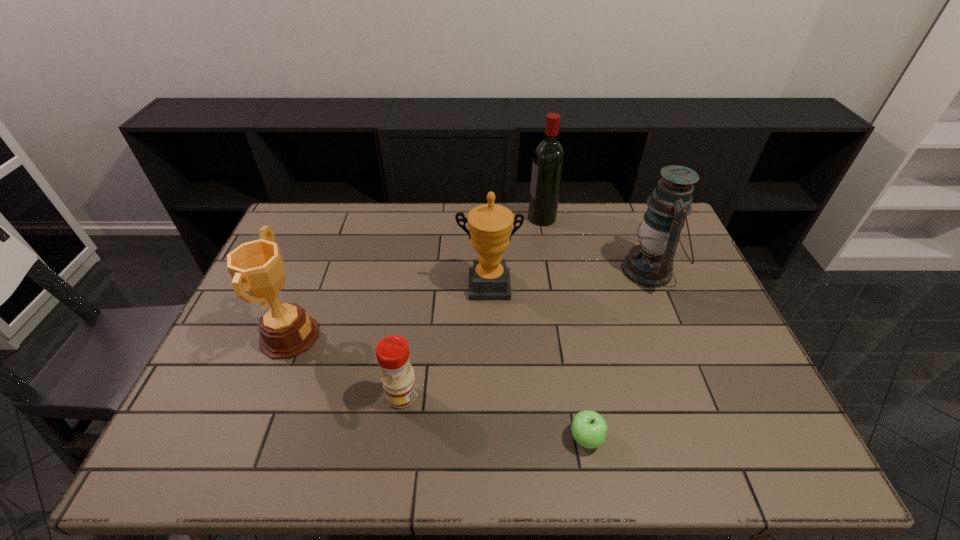
The image size is (960, 540). Identify the location of wine bottle. (548, 161).

This screenshot has height=540, width=960. What are the coordinates of `oil lamp` in the screenshot? It's located at (650, 264).

At what (x,y) coordinates should I click in order to perform the action: click on the farther award. Please return your answer as a coordinate pair (x, y). Looking at the image, I should click on (490, 225).

I want to click on the right award, so click(x=490, y=225).

Locate an element on the screen. The width and height of the screenshot is (960, 540). the nearer award is located at coordinates (286, 330).

Where is `the leftmost object`? the leftmost object is located at coordinates (286, 330).

Locate an element on the screen. The width and height of the screenshot is (960, 540). condiment is located at coordinates click(x=392, y=352).

What are the coordinates of `the fifth object from right to left` in the screenshot? It's located at (392, 352).

Where is `apple`? Image resolution: width=960 pixels, height=540 pixels. apple is located at coordinates click(589, 429).

Where is `the shortest object`? the shortest object is located at coordinates (589, 429).